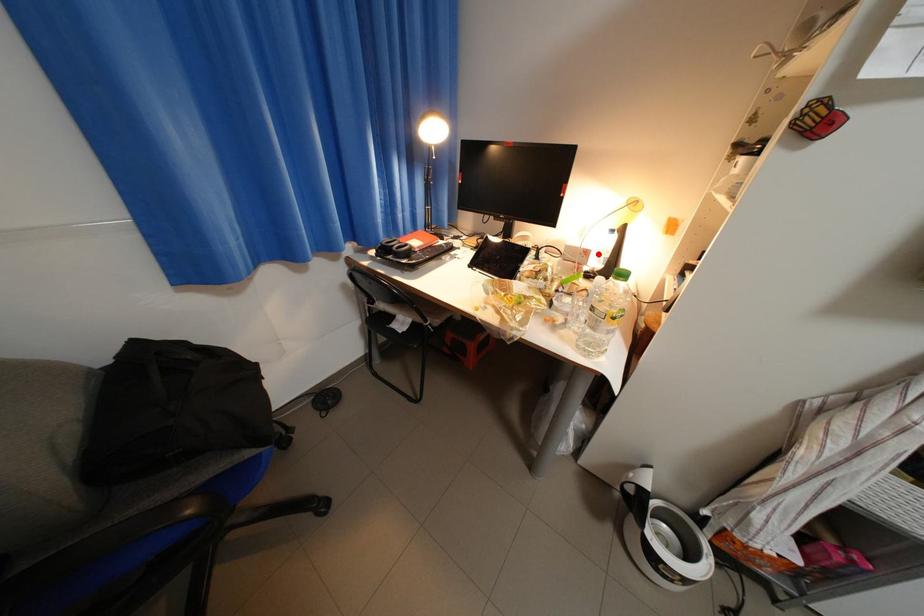
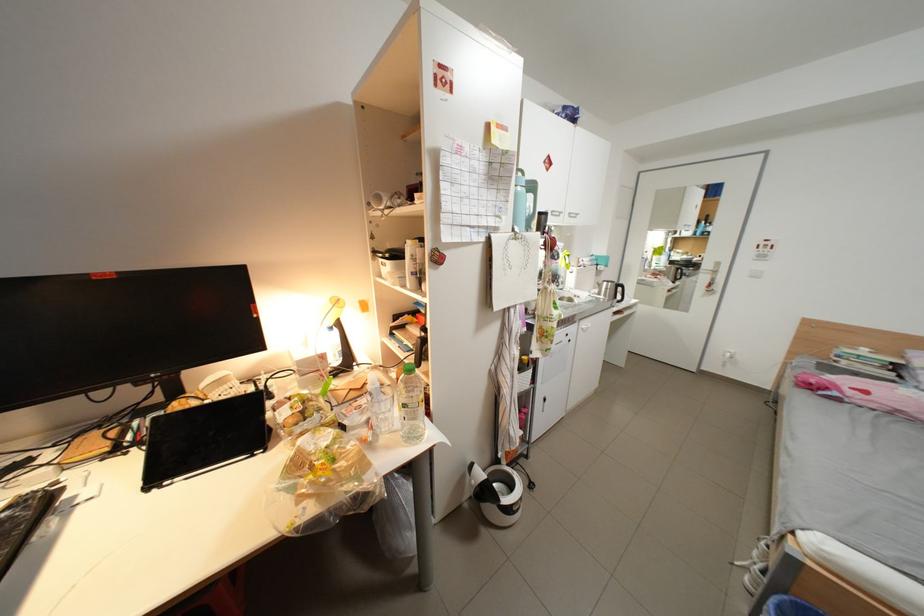
Locate, in the second image, the point that corresponds to the highlighted location in the first image.

(334, 358)